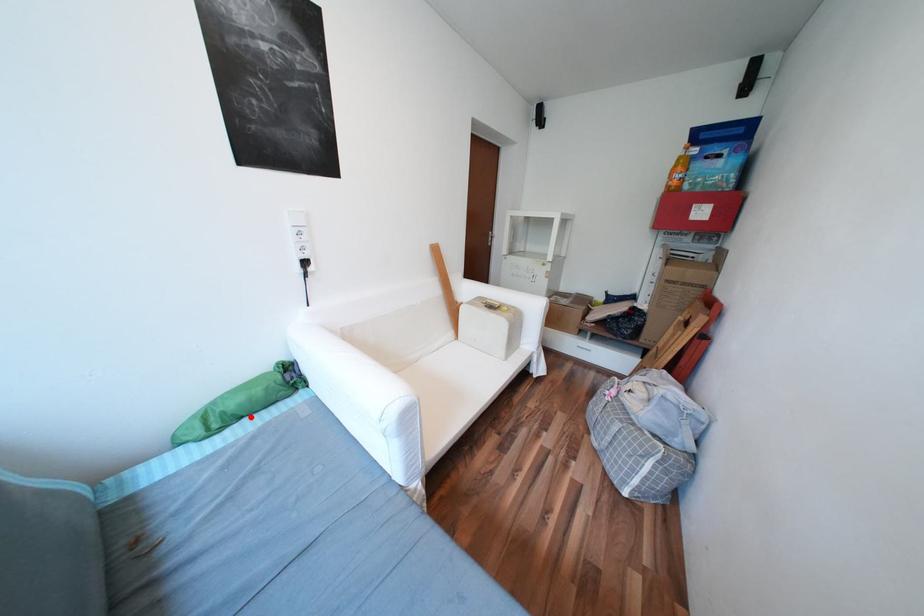
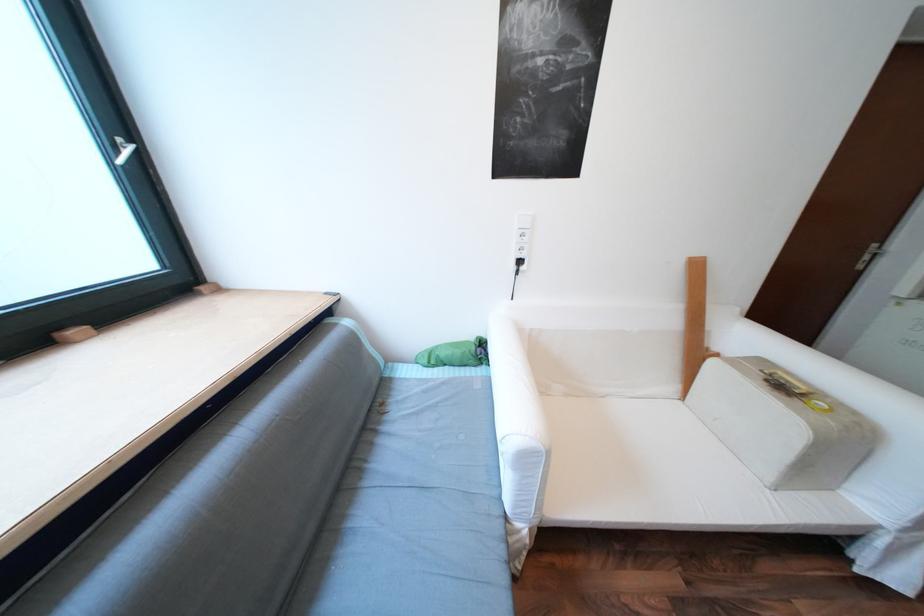
Question: A red point is marked in image1. In image2, is the corresponding 3D point closer to the camera or farther? Reply with the corresponding letter.

Choices:
 (A) The corresponding 3D point is closer.
 (B) The corresponding 3D point is farther.

Answer: (B)